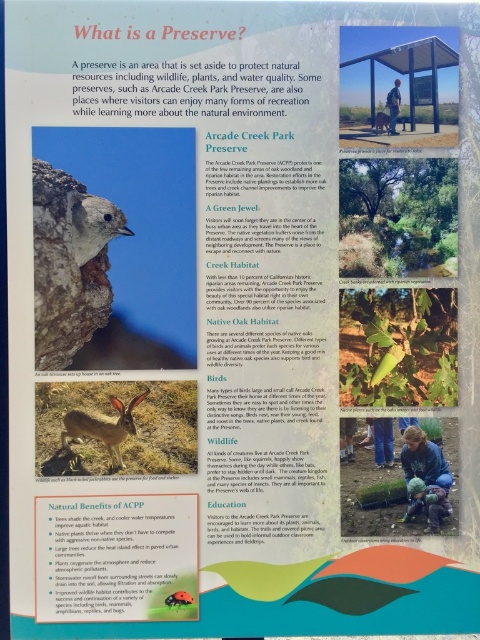
Who is more distant from viewer, (66, 419) or (187, 602)?

Point (66, 419)

Can you confirm if brown furry rabbit at lower left is bigger than green leafy plant at lower left?

Correct, brown furry rabbit at lower left is larger in size than green leafy plant at lower left.

Does point (111, 465) come farther from viewer compared to point (169, 600)?

Yes, it is behind point (169, 600).

In order to click on brown furry rabbit at lower left in this screenshot , I will do `click(103, 426)`.

Can you confirm if gray furry bird at upper left is positioned below brown furry rabbit at lower left?

No.

What do you see at coordinates (94, 225) in the screenshot? I see `gray furry bird at upper left` at bounding box center [94, 225].

In order to click on gray furry bird at upper left in this screenshot , I will do `click(94, 225)`.

Between blue denim jacket at lower right and brown fur rabbit at center, which one appears on the left side from the viewer's perspective?

Positioned to the left is brown fur rabbit at center.

Which is below, blue denim jacket at lower right or brown fur rabbit at center?

Positioned lower is blue denim jacket at lower right.

Is point (416, 504) positioned in front of point (387, 132)?

No, (416, 504) is behind (387, 132).

Locate an element on the screen. The image size is (480, 640). blue denim jacket at lower right is located at coordinates (428, 502).